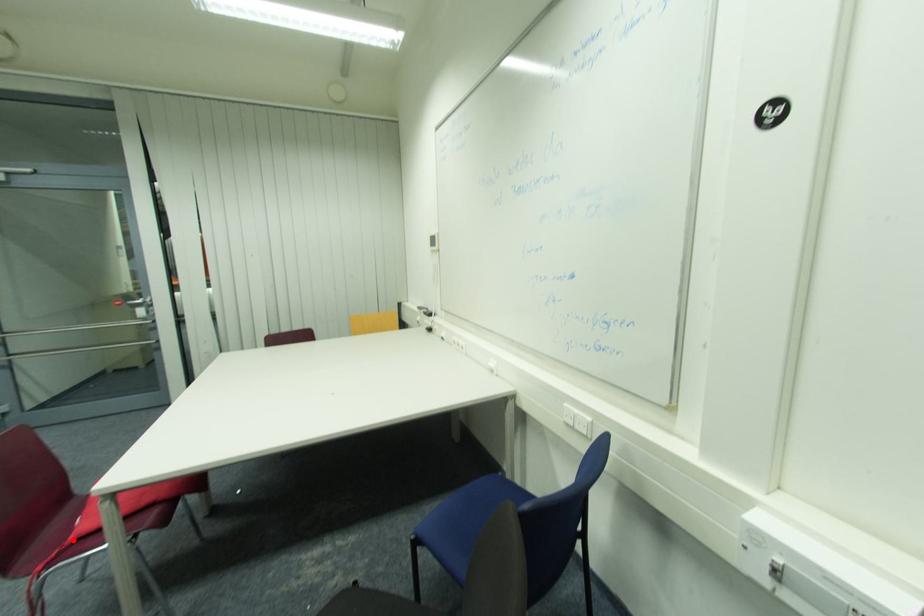
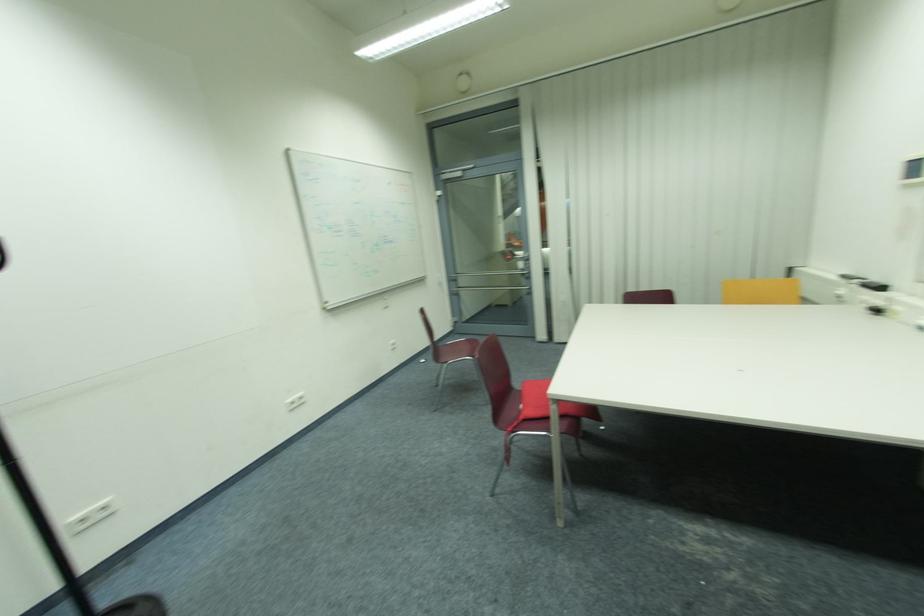
Question: I am providing you with two images of the same scene from different viewpoints. A red point is marked on the first image. At the location where the point appears in image 1, is it still visible in image 2?

Choices:
 (A) Yes
 (B) No

Answer: (A)